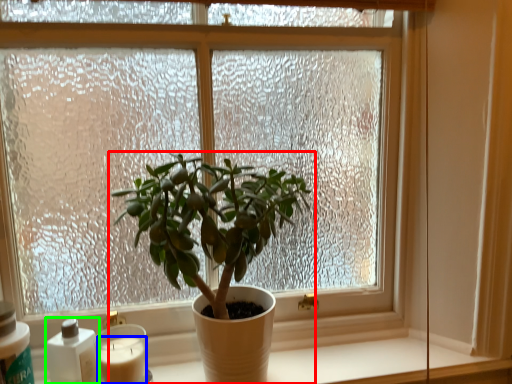
Question: Based on their relative distances, which object is nearer to houseplant (highlighted by a red box)? Choose from candle (highlighted by a blue box) and bottle (highlighted by a green box).

Choices:
 (A) candle
 (B) bottle

Answer: (A)